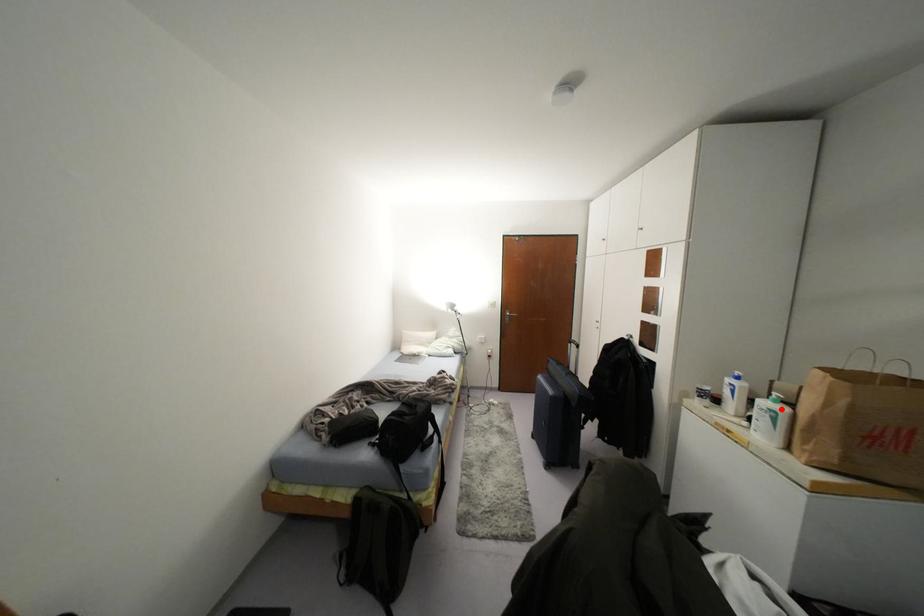
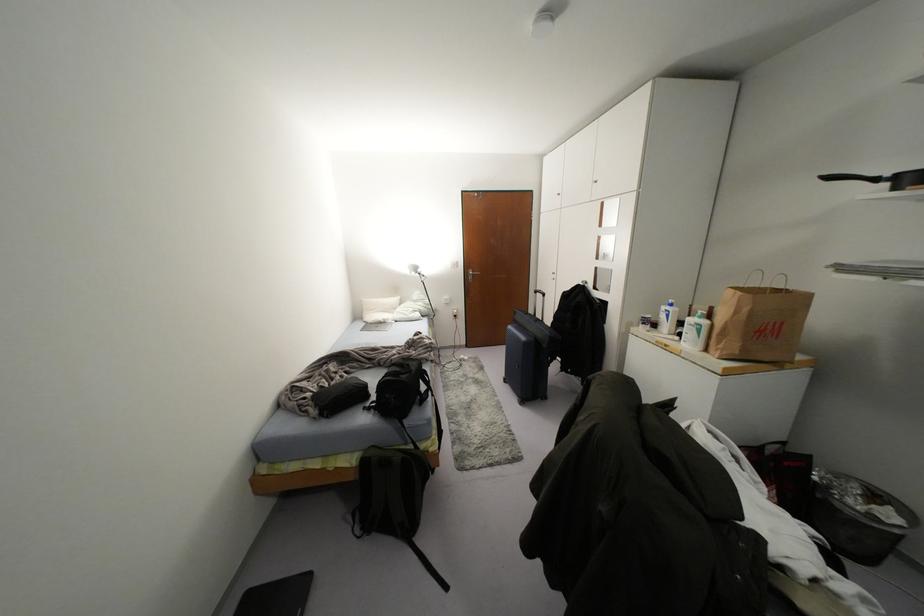
Question: I am providing you with two images of the same scene from different viewpoints. Image1 has a red point marked. In image2, the corresponding 3D location appears at what relative position? Reply with the corresponding letter.

Choices:
 (A) Closer
 (B) Farther

Answer: (A)